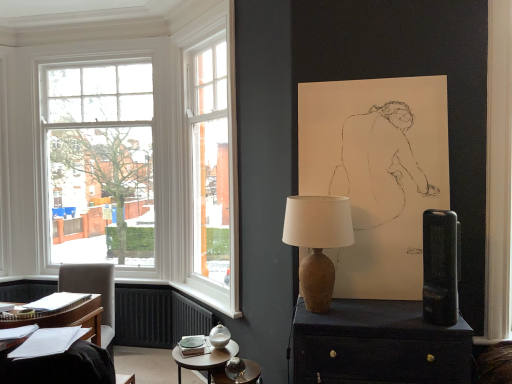
I want to click on vacant space that is to the left of black plastic speaker at right, so 399,324.